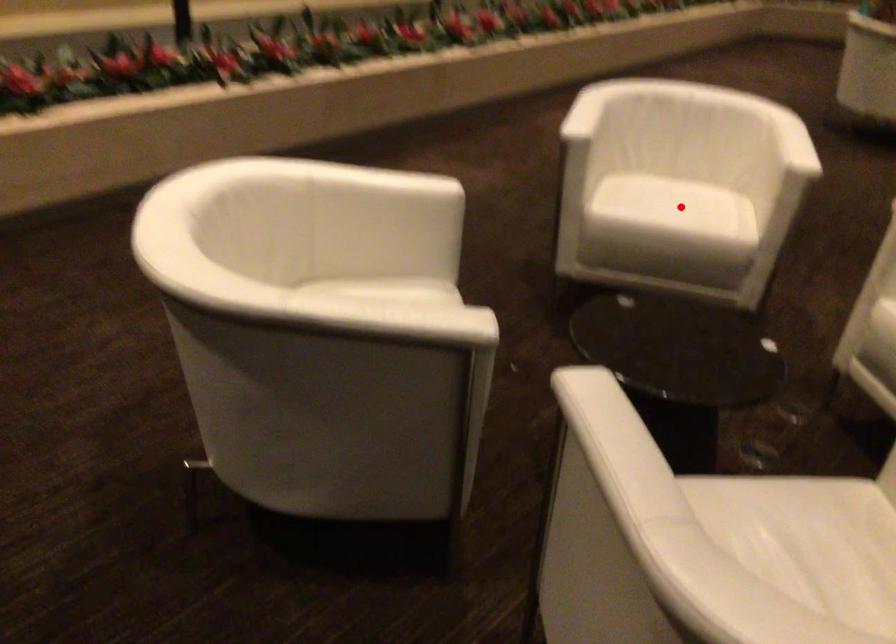
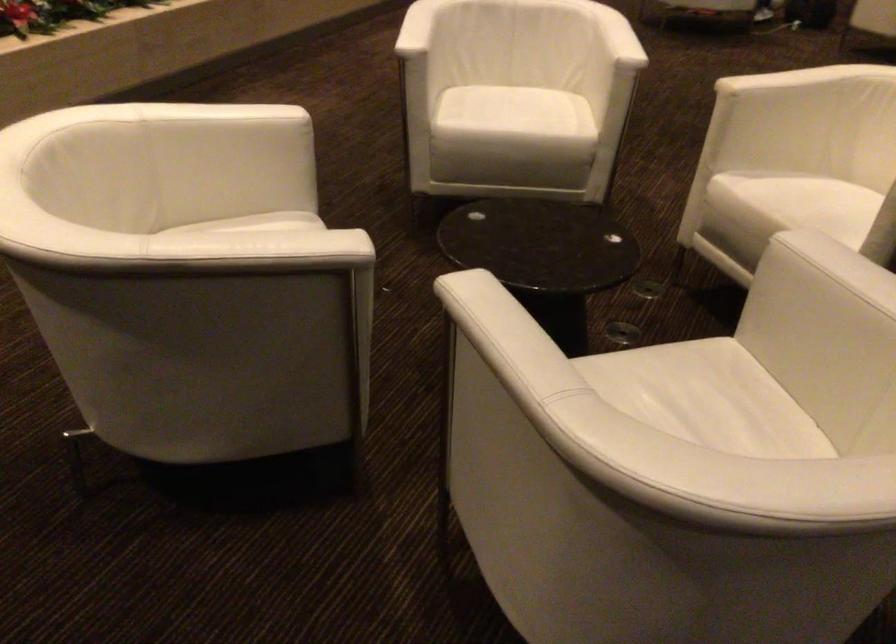
The point at the highlighted location is marked in the first image. Where is the corresponding point in the second image?

(524, 117)